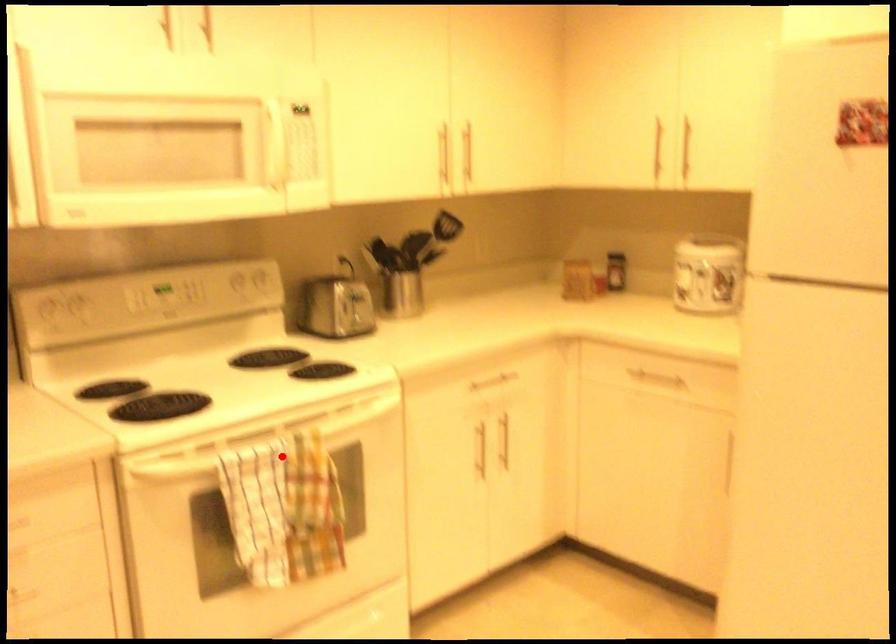
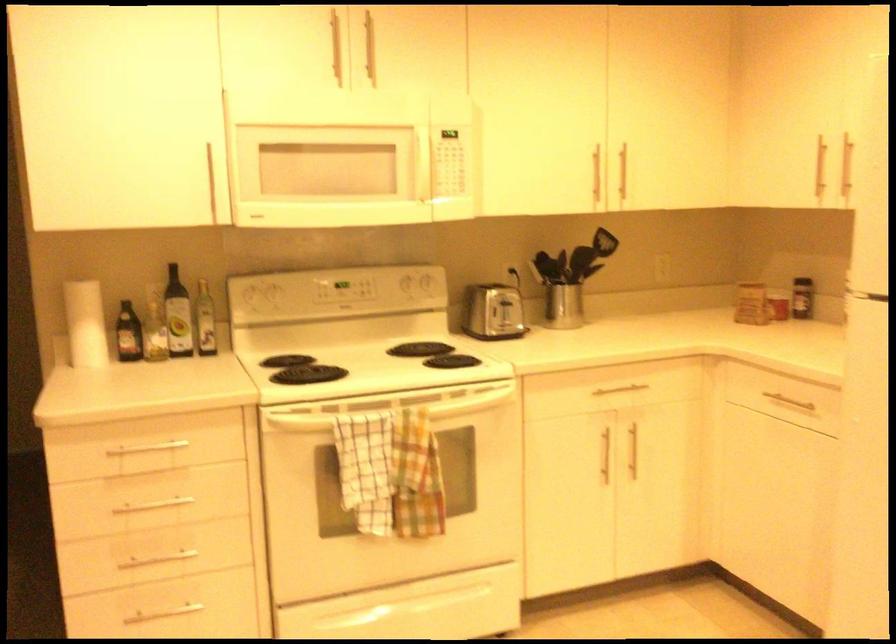
Find the pixel in the second image that matches the highlighted location in the first image.

(390, 424)